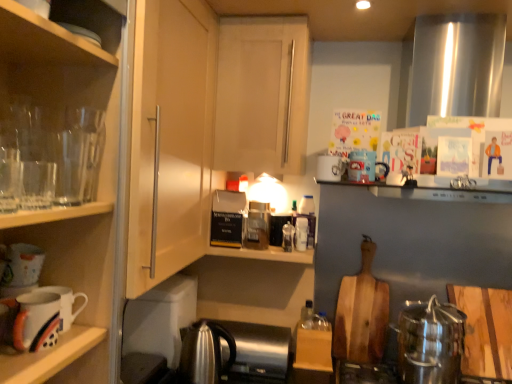
Question: From the image's perspective, is transparent glassware at left under white glossy mug at upper center, which is the first mug from top to bottom?

Choices:
 (A) yes
 (B) no

Answer: (B)

Question: Is transparent glassware at left with white glossy mug at upper center, which ranks as the 3th mug in bottom-to-top order?

Choices:
 (A) yes
 (B) no

Answer: (B)

Question: Is transparent glassware at left closer to the viewer compared to white glossy mug at upper center, which is counted as the first mug, starting from the right?

Choices:
 (A) yes
 (B) no

Answer: (A)

Question: Is the position of transparent glassware at left more distant than that of white glossy mug at upper center, which ranks as the 3th mug in bottom-to-top order?

Choices:
 (A) no
 (B) yes

Answer: (A)

Question: From a real-world perspective, is transparent glassware at left beneath white glossy mug at upper center, which ranks as the 3th mug in bottom-to-top order?

Choices:
 (A) yes
 (B) no

Answer: (B)

Question: From the image's perspective, is translucent plastic bottle at shelf center, marked as the 1th bottle in a left-to-right arrangement, positioned above or below satin silver kettle at lower right?

Choices:
 (A) above
 (B) below

Answer: (A)

Question: From a real-world perspective, is translucent plastic bottle at shelf center, placed as the first bottle when sorted from front to back, above or below satin silver kettle at lower right?

Choices:
 (A) below
 (B) above

Answer: (B)

Question: Relative to satin silver kettle at lower right, is translucent plastic bottle at shelf center, marked as the second bottle in a back-to-front arrangement, in front or behind?

Choices:
 (A) front
 (B) behind

Answer: (B)

Question: Considering the positions of translucent plastic bottle at shelf center, positioned as the 2th bottle in right-to-left order, and satin silver kettle at lower right in the image, is translucent plastic bottle at shelf center, positioned as the 2th bottle in right-to-left order, taller or shorter than satin silver kettle at lower right?

Choices:
 (A) tall
 (B) short

Answer: (B)

Question: Is wooden cutting board at lower right, which ranks as the second cutting board in left-to-right order, wider or thinner than white matte cabinet door at center, marked as the 1th cabinetry in a back-to-front arrangement?

Choices:
 (A) thin
 (B) wide

Answer: (A)

Question: In terms of size, does wooden cutting board at lower right, arranged as the first cutting board when viewed from the front, appear bigger or smaller than white matte cabinet door at center, the second cabinetry in the front-to-back sequence?

Choices:
 (A) small
 (B) big

Answer: (A)

Question: From the image's perspective, relative to white matte cabinet door at center, acting as the 1th cabinetry starting from the right, is wooden cutting board at lower right, arranged as the first cutting board when viewed from the front, above or below?

Choices:
 (A) below
 (B) above

Answer: (A)

Question: Does point (464, 347) appear closer or farther from the camera than point (305, 87)?

Choices:
 (A) closer
 (B) farther

Answer: (B)

Question: From a real-world perspective, relative to transparent glass cabinet at left, which is the first cabinetry in left-to-right order, is translucent plastic bottle at shelf center, marked as the 1th bottle in a left-to-right arrangement, vertically above or below?

Choices:
 (A) below
 (B) above

Answer: (A)

Question: Do you think translucent plastic bottle at shelf center, marked as the 1th bottle in a left-to-right arrangement, is within transparent glass cabinet at left, arranged as the 2th cabinetry when viewed from the right, or outside of it?

Choices:
 (A) inside
 (B) outside

Answer: (B)